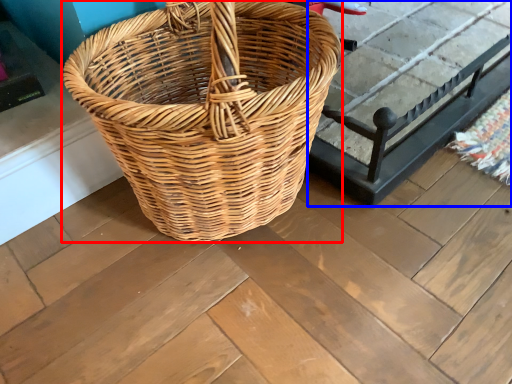
Question: Which object appears closest to the camera in this image, picnic basket (highlighted by a red box) or table (highlighted by a blue box)?

Choices:
 (A) picnic basket
 (B) table

Answer: (A)